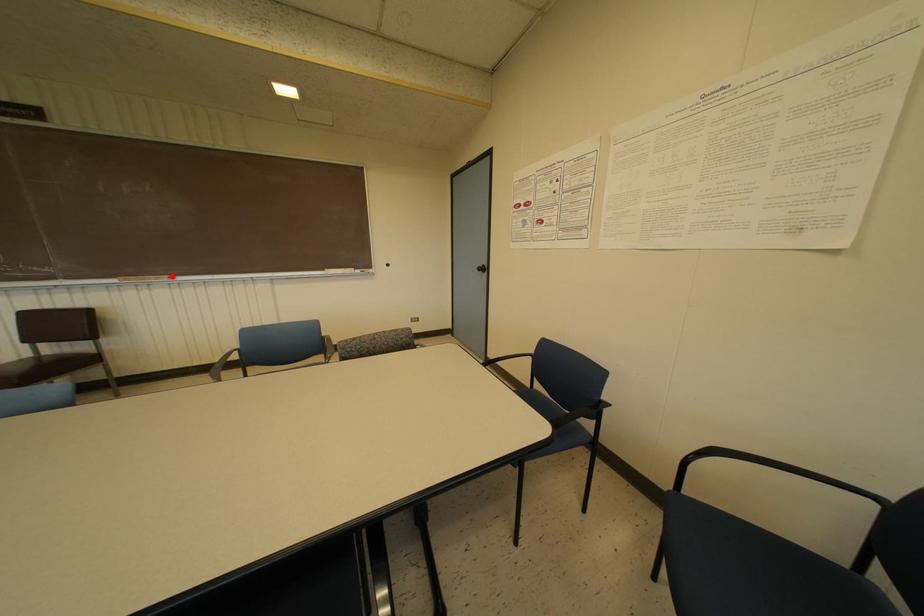
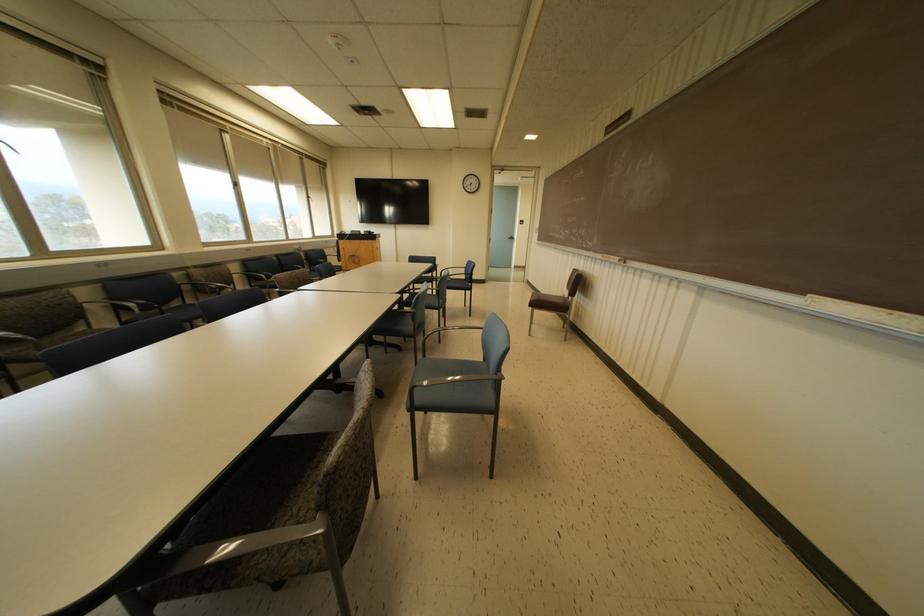
Locate, in the second image, the point that corresponds to the highlighted location in the first image.

(623, 259)